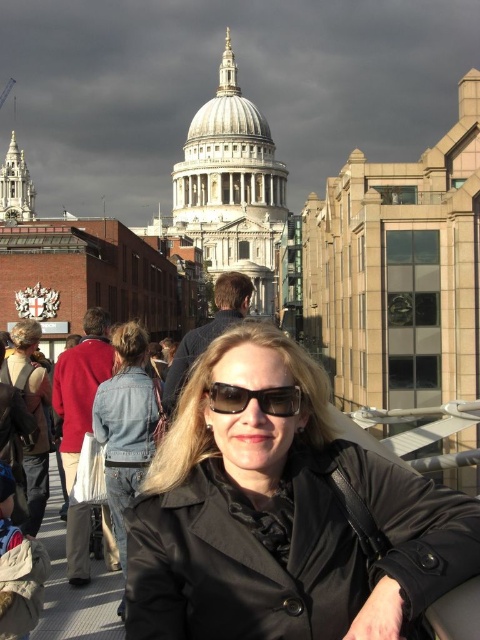
You are a photographer trying to capture both the black matte jacket at center and the denim jacket at center in the same frame. Based on their positions, which jacket should you focus on first to ensure both are in the shot?

Since the black matte jacket at center is to the right of the denim jacket at center, you should focus on the denim jacket at center first to ensure both are in the shot.

You are a photographer trying to capture the woman in the scene. You notice the denim jacket at center and the black plastic sunglasses at center. Which object is positioned lower on her body?

The denim jacket at center is positioned lower on her body than the black plastic sunglasses at center.

You are a photographer trying to capture both the black matte jacket at center and the denim jacket at lower left in a single frame. Which jacket should you focus on first to ensure both are in focus?

You should focus on the black matte jacket at center first since it is closer to the viewer than the denim jacket at lower left, allowing the depth of field to cover both subjects.